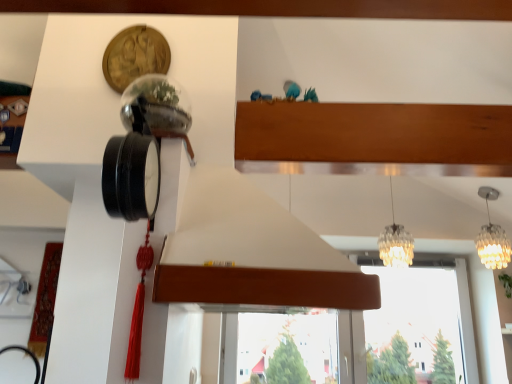
Describe the element at coordinates (417, 326) in the screenshot. I see `transparent glass window at center` at that location.

The height and width of the screenshot is (384, 512). Describe the element at coordinates (252, 253) in the screenshot. I see `wooden at upper center` at that location.

What do you see at coordinates (492, 237) in the screenshot?
I see `translucent glass chandelier at upper right, the 1th lamp in the right-to-left sequence` at bounding box center [492, 237].

At what (x,y) coordinates should I click in order to perform the action: click on transparent glass window at center. Please return your answer as a coordinate pair (x, y). This screenshot has height=384, width=512. Looking at the image, I should click on (417, 326).

Can you tell me how much transparent glass window at center and wooden at upper center differ in facing direction?

The facing directions of transparent glass window at center and wooden at upper center are 90.6 degrees apart.

Which is correct: transparent glass window at center is inside wooden at upper center, or outside of it?

transparent glass window at center cannot be found inside wooden at upper center.

Based on their sizes in the image, would you say transparent glass window at center is bigger or smaller than wooden at upper center?

Considering their sizes, transparent glass window at center takes up less space than wooden at upper center.

Between translucent glass chandelier at upper right, the 2th lamp when ordered from left to right, and transparent glass window at center, which one is positioned in front?

Positioned in front is translucent glass chandelier at upper right, the 2th lamp when ordered from left to right.

Is translucent glass chandelier at upper right, the 2th lamp when ordered from left to right, facing away from transparent glass window at center?

No, translucent glass chandelier at upper right, the 2th lamp when ordered from left to right, is not facing away from transparent glass window at center.

Does translucent glass chandelier at upper right, the 1th lamp in the right-to-left sequence, have a lesser height compared to transparent glass window at center?

Indeed, translucent glass chandelier at upper right, the 1th lamp in the right-to-left sequence, has a lesser height compared to transparent glass window at center.

What's the angular difference between wooden at upper center and transparent glass window at center's facing directions?

There is a 90.6-degree angle between the facing directions of wooden at upper center and transparent glass window at center.

Considering the points (203, 231) and (464, 276), which point is behind, point (203, 231) or point (464, 276)?

The point (464, 276) is more distant.

Is wooden at upper center thinner than transparent glass window at center?

Incorrect, the width of wooden at upper center is not less than that of transparent glass window at center.

Is the surface of wooden at upper center in direct contact with transparent glass window at center?

No, wooden at upper center is not next to transparent glass window at center.

Where is `lamp below the translucent glass chandelier at center, the 1th lamp in the left-to-right sequence (from a real-world perspective)`? lamp below the translucent glass chandelier at center, the 1th lamp in the left-to-right sequence (from a real-world perspective) is located at coordinates (492, 237).

From a real-world perspective, is translucent glass chandelier at upper right, the 2th lamp when ordered from left to right, under translucent glass chandelier at center, placed as the second lamp when sorted from right to left?

Yes.

Which is more to the right, translucent glass chandelier at upper right, the 2th lamp when ordered from left to right, or translucent glass chandelier at center, the 1th lamp in the left-to-right sequence?

translucent glass chandelier at upper right, the 2th lamp when ordered from left to right.

How different are the orientations of translucent glass chandelier at upper right, the 1th lamp in the right-to-left sequence, and translucent glass chandelier at center, the 1th lamp in the left-to-right sequence, in degrees?

0.000353 degrees.

Does transparent glass window at center come behind translucent glass chandelier at upper right, the 1th lamp in the right-to-left sequence?

Yes.

Identify the location of window lying on the left of translucent glass chandelier at upper right, the 1th lamp in the right-to-left sequence. (417, 326).

In the scene shown: Considering the sizes of objects transparent glass window at center and translucent glass chandelier at upper right, the 2th lamp when ordered from left to right, in the image provided, who is wider, transparent glass window at center or translucent glass chandelier at upper right, the 2th lamp when ordered from left to right,?

With larger width is translucent glass chandelier at upper right, the 2th lamp when ordered from left to right.

Is wooden at upper center bigger than translucent glass chandelier at upper right, the 2th lamp when ordered from left to right?

Indeed, wooden at upper center has a larger size compared to translucent glass chandelier at upper right, the 2th lamp when ordered from left to right.

Is wooden at upper center positioned behind translucent glass chandelier at upper right, the 2th lamp when ordered from left to right?

That is False.

From the image's perspective, between wooden at upper center and translucent glass chandelier at upper right, the 1th lamp in the right-to-left sequence, which one is located above?

wooden at upper center appears higher in the image.

Considering the positions of point (224, 240) and point (502, 254), is point (224, 240) closer or farther from the camera than point (502, 254)?

Clearly, point (224, 240) is closer to the camera than point (502, 254).

How distant is translucent glass chandelier at center, the 1th lamp in the left-to-right sequence, from translucent glass chandelier at upper right, the 1th lamp in the right-to-left sequence?

20.47 inches.

From the image's perspective, is translucent glass chandelier at center, placed as the second lamp when sorted from right to left, below translucent glass chandelier at upper right, the 1th lamp in the right-to-left sequence?

Actually, translucent glass chandelier at center, placed as the second lamp when sorted from right to left, appears above translucent glass chandelier at upper right, the 1th lamp in the right-to-left sequence, in the image.

Is translucent glass chandelier at center, the 1th lamp in the left-to-right sequence, to the left of translucent glass chandelier at upper right, the 2th lamp when ordered from left to right, from the viewer's perspective?

Correct, you'll find translucent glass chandelier at center, the 1th lamp in the left-to-right sequence, to the left of translucent glass chandelier at upper right, the 2th lamp when ordered from left to right.

Considering the points (409, 234) and (487, 197), which point is in front, point (409, 234) or point (487, 197)?

Positioned in front is point (409, 234).

You are a GUI agent. You are given a task and a screenshot of the screen. Output one action in this format:
    pyautogui.click(x=<x>, y=<y>)
    Task: Click on the exhaust hood that appears in front of the transparent glass window at center
    This screenshot has width=512, height=384.
    Given the screenshot: What is the action you would take?
    click(252, 253)

Where is `window located underneath the translucent glass chandelier at upper right, the 2th lamp when ordered from left to right (from a real-world perspective)`? Image resolution: width=512 pixels, height=384 pixels. window located underneath the translucent glass chandelier at upper right, the 2th lamp when ordered from left to right (from a real-world perspective) is located at coordinates (417, 326).

Based on their spatial positions, is transparent glass window at center or translucent glass chandelier at center, the 1th lamp in the left-to-right sequence, further from translucent glass chandelier at upper right, the 1th lamp in the right-to-left sequence?

Based on the image, transparent glass window at center appears to be further to translucent glass chandelier at upper right, the 1th lamp in the right-to-left sequence.

When comparing their distances from translucent glass chandelier at center, placed as the second lamp when sorted from right to left, does wooden at upper center or translucent glass chandelier at upper right, the 2th lamp when ordered from left to right, seem further?

Among the two, wooden at upper center is located further to translucent glass chandelier at center, placed as the second lamp when sorted from right to left.

Looking at the image, which one is located further to wooden at upper center, translucent glass chandelier at center, placed as the second lamp when sorted from right to left, or transparent glass window at center?

The object further to wooden at upper center is transparent glass window at center.

Looking at the image, which one is located further to translucent glass chandelier at center, placed as the second lamp when sorted from right to left, transparent glass window at center or translucent glass chandelier at upper right, the 1th lamp in the right-to-left sequence?

Among the two, transparent glass window at center is located further to translucent glass chandelier at center, placed as the second lamp when sorted from right to left.

From the image, which object appears to be nearer to transparent glass window at center, translucent glass chandelier at center, the 1th lamp in the left-to-right sequence, or wooden at upper center?

translucent glass chandelier at center, the 1th lamp in the left-to-right sequence, is positioned closer to the anchor transparent glass window at center.

Based on their spatial positions, is translucent glass chandelier at center, the 1th lamp in the left-to-right sequence, or translucent glass chandelier at upper right, the 2th lamp when ordered from left to right, closer to wooden at upper center?

translucent glass chandelier at center, the 1th lamp in the left-to-right sequence, lies closer to wooden at upper center than the other object.

Estimate the real-world distances between objects in this image. Which object is closer to translucent glass chandelier at center, placed as the second lamp when sorted from right to left, wooden at upper center or transparent glass window at center?

Among the two, transparent glass window at center is located nearer to translucent glass chandelier at center, placed as the second lamp when sorted from right to left.

From the image, which object appears to be farther from translucent glass chandelier at center, placed as the second lamp when sorted from right to left, translucent glass chandelier at upper right, the 2th lamp when ordered from left to right, or wooden at upper center?

wooden at upper center is further to translucent glass chandelier at center, placed as the second lamp when sorted from right to left.

I want to click on lamp between wooden at upper center and translucent glass chandelier at upper right, the 1th lamp in the right-to-left sequence, in the front-back direction, so click(x=395, y=243).

Image resolution: width=512 pixels, height=384 pixels. Identify the location of lamp between translucent glass chandelier at center, the 1th lamp in the left-to-right sequence, and transparent glass window at center from top to bottom. (492, 237).